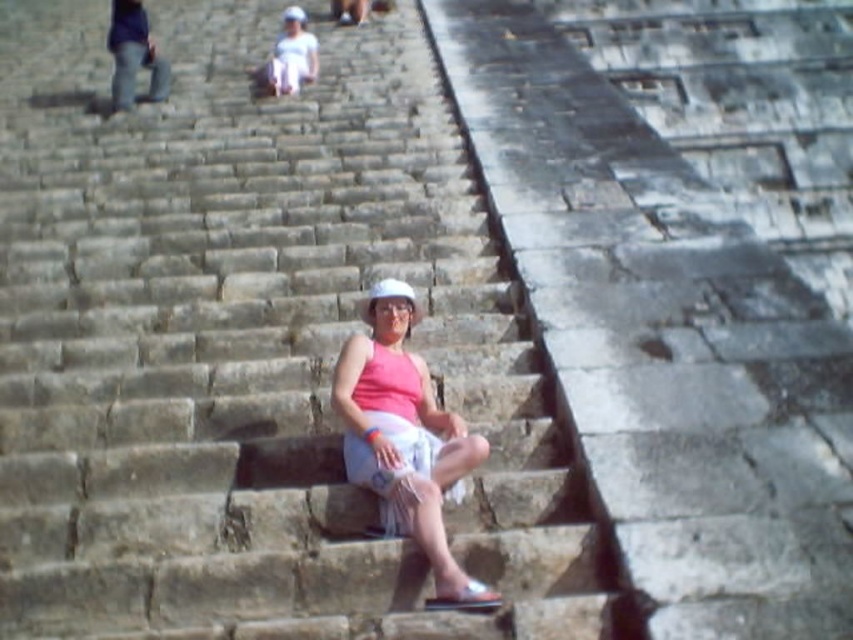
You are a tour guide leading a group up the ancient stone staircase. You notice the pink fabric at center and the stone stairs at center. How far apart are these two objects?

The distance between the stone stairs at center and the pink fabric at center is 65.33 feet.

You are planning to take a photo of the stone stairs at center and the pink fabric at center. Which object should you focus on first if you want to capture both in a single frame, considering their sizes?

The stone stairs at center has a larger size compared to the pink fabric at center, so you should focus on the stone stairs at center first to ensure both are in frame.